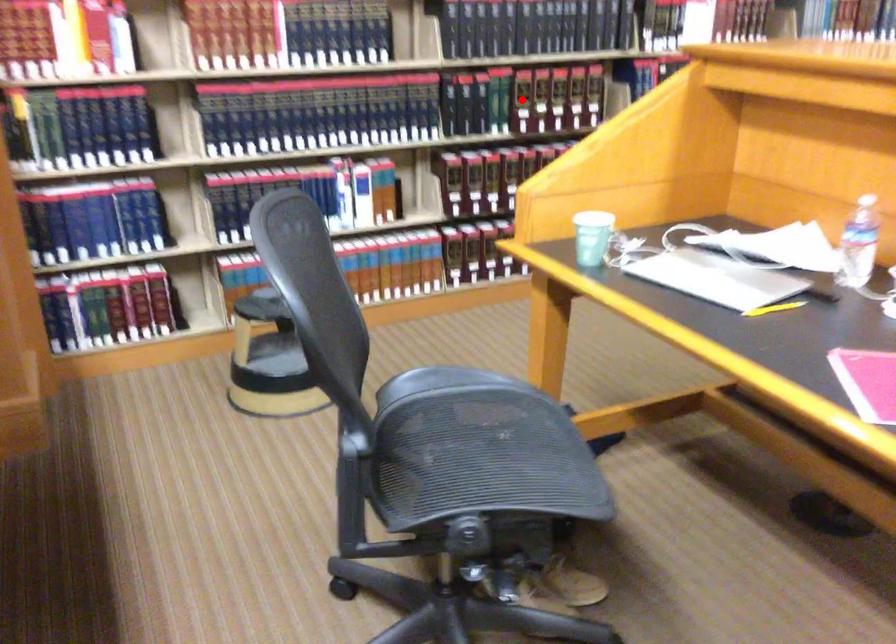
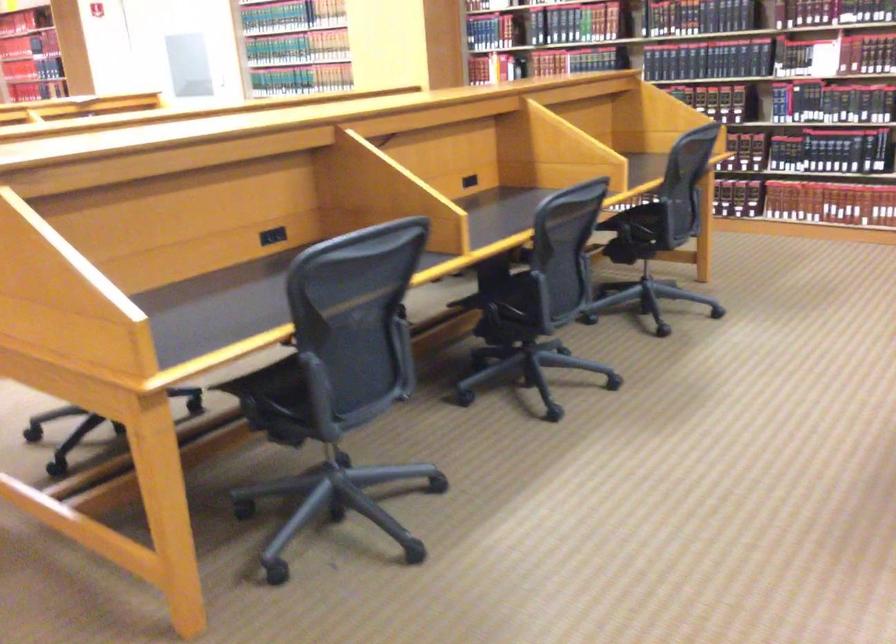
Question: I am providing you with two images of the same scene from different viewpoints. A red point is marked on the first image. At the location where the point appears in image 1, is it still visible in image 2?

Choices:
 (A) Yes
 (B) No

Answer: (B)